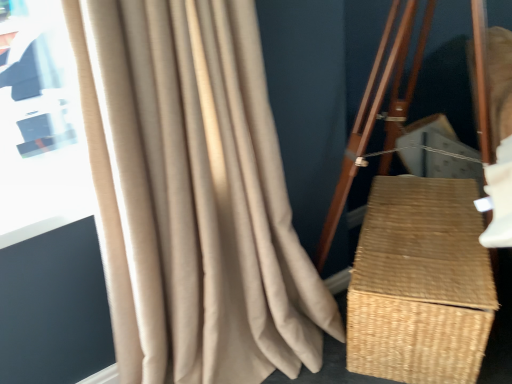
Question: Can we say woven natural basket at right lies outside beige textured curtain at left?

Choices:
 (A) no
 (B) yes

Answer: (B)

Question: Considering the relative sizes of woven natural basket at right and beige textured curtain at left in the image provided, is woven natural basket at right wider than beige textured curtain at left?

Choices:
 (A) no
 (B) yes

Answer: (B)

Question: Could you tell me if woven natural basket at right is facing beige textured curtain at left?

Choices:
 (A) no
 (B) yes

Answer: (A)

Question: From a real-world perspective, does woven natural basket at right sit lower than beige textured curtain at left?

Choices:
 (A) yes
 (B) no

Answer: (A)

Question: From the image's perspective, is woven natural basket at right below beige textured curtain at left?

Choices:
 (A) no
 (B) yes

Answer: (B)

Question: Considering the relative positions of woven natural basket at right and beige textured curtain at left in the image provided, is woven natural basket at right behind beige textured curtain at left?

Choices:
 (A) no
 (B) yes

Answer: (B)

Question: Is beige textured curtain at left further to the viewer compared to woven natural basket at right?

Choices:
 (A) yes
 (B) no

Answer: (B)

Question: Does beige textured curtain at left have a lesser height compared to woven natural basket at right?

Choices:
 (A) no
 (B) yes

Answer: (A)

Question: Is beige textured curtain at left beside woven natural basket at right?

Choices:
 (A) no
 (B) yes

Answer: (A)

Question: Can you confirm if beige textured curtain at left is taller than woven natural basket at right?

Choices:
 (A) yes
 (B) no

Answer: (A)

Question: Considering the relative sizes of beige textured curtain at left and woven natural basket at right in the image provided, is beige textured curtain at left smaller than woven natural basket at right?

Choices:
 (A) no
 (B) yes

Answer: (A)

Question: From the image's perspective, is beige textured curtain at left over woven natural basket at right?

Choices:
 (A) no
 (B) yes

Answer: (B)

Question: In the image, is beige textured curtain at left on the left side or the right side of woven natural basket at right?

Choices:
 (A) right
 (B) left

Answer: (B)